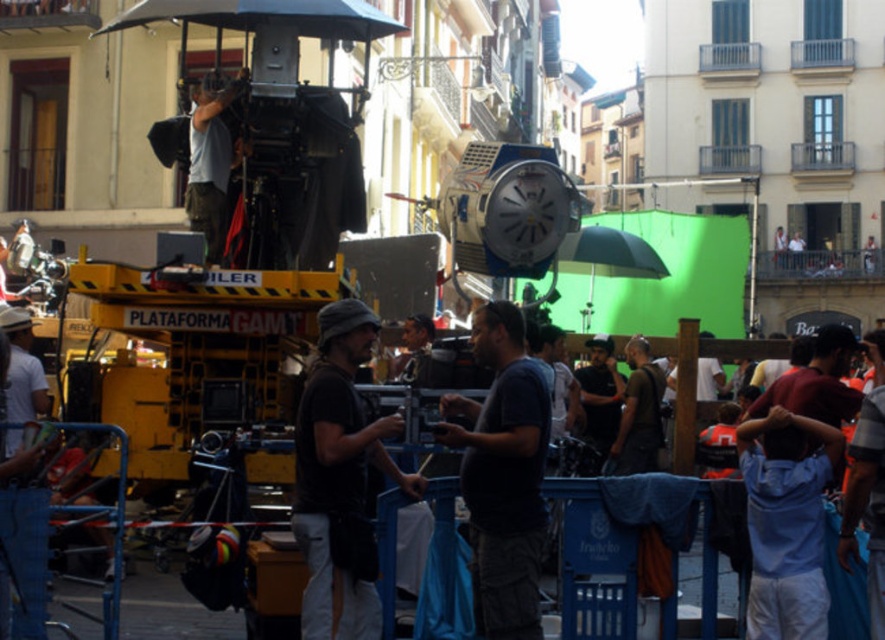
You are standing at the point marked as point (340, 480) in the image. What object are you standing on?

You are standing on the black fabric bag at center.

Where is the black fabric bag at center located in the image?

The black fabric bag at center is located at point (x=340, y=480) in the image.